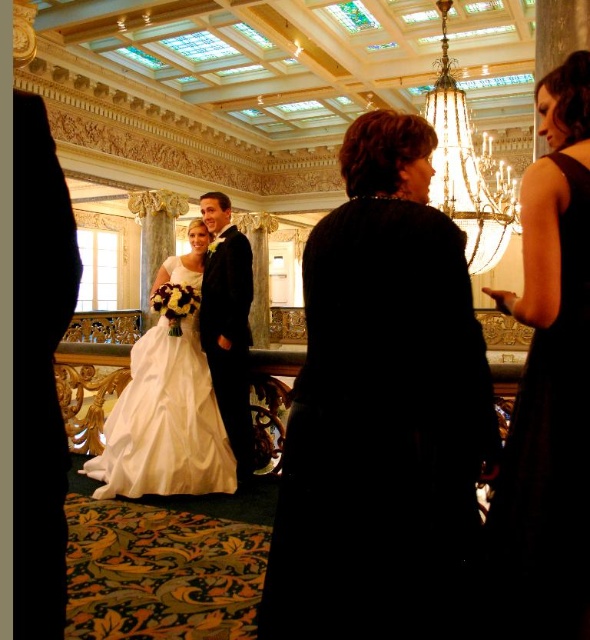
Is dark velvet dress at center to the left of gold crystal chandelier at upper center from the viewer's perspective?

Indeed, dark velvet dress at center is positioned on the left side of gold crystal chandelier at upper center.

Can you confirm if dark velvet dress at center is positioned above gold crystal chandelier at upper center?

No, dark velvet dress at center is not above gold crystal chandelier at upper center.

Which is in front, point (493, 424) or point (481, 234)?

Point (493, 424) is in front.

Where is `dark velvet dress at center`? dark velvet dress at center is located at coordinates (381, 410).

Consider the image. Who is lower down, black satin dress at right or white satin dress at center?

white satin dress at center is below.

Is point (494, 602) behind point (168, 477)?

That is False.

Measure the distance between black satin dress at right and camera.

The distance of black satin dress at right from camera is 44.05 feet.

I want to click on black satin dress at right, so (549, 384).

Is white satin dress at center thinner than gold crystal chandelier at upper center?

Yes.

I want to click on white satin dress at center, so click(x=165, y=420).

The width and height of the screenshot is (590, 640). What are the coordinates of `white satin dress at center` in the screenshot? It's located at (165, 420).